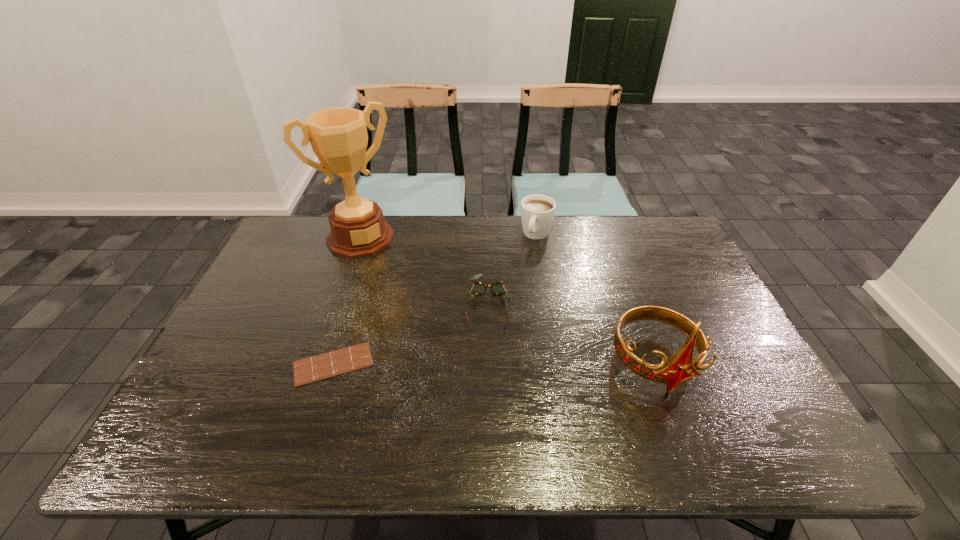
The height and width of the screenshot is (540, 960). In order to click on vacant space situated 0.280m with the handle on the side of the fourth object from left to right in this screenshot , I will do `click(507, 302)`.

Locate an element on the screen. This screenshot has height=540, width=960. free location located 0.390m with the handle on the side of the fourth object from left to right is located at coordinates (495, 329).

Locate an element on the screen. This screenshot has width=960, height=540. vacant point located on the front-facing side of the third object from right to left is located at coordinates [486, 396].

I want to click on free space located on the front-facing side of the third object from right to left, so click(487, 356).

Locate an element on the screen. vacant position located 0.090m on the front-facing side of the third object from right to left is located at coordinates (487, 356).

The height and width of the screenshot is (540, 960). I want to click on free space located on the front-facing side of the award, so click(x=422, y=318).

Find the location of `vacant space located on the front-facing side of the award`. vacant space located on the front-facing side of the award is located at coordinates (393, 278).

The width and height of the screenshot is (960, 540). In order to click on free location located 0.360m on the front-facing side of the award in this screenshot , I will do `click(427, 325)`.

This screenshot has width=960, height=540. In order to click on cappuccino that is at the far edge in this screenshot , I will do (537, 211).

I want to click on award that is at the far edge, so tap(338, 136).